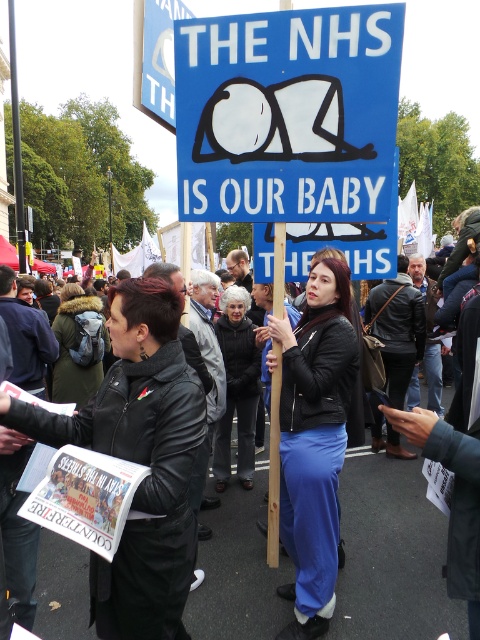
Question: Considering the real-world distances, which object is farthest from the black leather jacket at center?

Choices:
 (A) matte black jacket at center
 (B) blue paper sign at center

Answer: (B)

Question: Which object is positioned farthest from the black leather jacket at center?

Choices:
 (A) blue paper sign at center
 (B) matte black jacket at center

Answer: (A)

Question: Which of the following is the closest to the observer?

Choices:
 (A) (311, 584)
 (B) (72, 556)

Answer: (A)

Question: Can you confirm if blue paper sign at center is thinner than black leather jacket at center?

Choices:
 (A) yes
 (B) no

Answer: (A)

Question: Is blue paper sign at center thinner than black leather jacket at center?

Choices:
 (A) yes
 (B) no

Answer: (A)

Question: In this image, where is blue paper sign at center located relative to black leather jacket at center?

Choices:
 (A) right
 (B) left

Answer: (B)